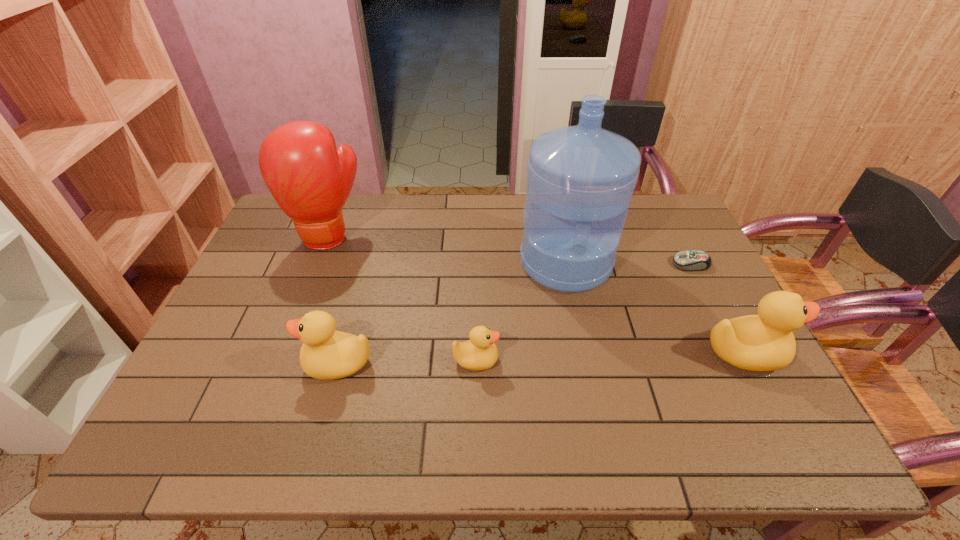
The width and height of the screenshot is (960, 540). What are the coordinates of `vacant space at the near right corner of the desktop` in the screenshot? It's located at (768, 384).

You are a GUI agent. You are given a task and a screenshot of the screen. Output one action in this format:
    pyautogui.click(x=<x>, y=<y>)
    Task: Click on the free spot between the leftmost duck and the shortest object
    
    Given the screenshot: What is the action you would take?
    pyautogui.click(x=515, y=314)

Where is `free space between the second shortest duck and the fifth tallest object`? free space between the second shortest duck and the fifth tallest object is located at coordinates (407, 362).

Locate an element on the screen. This screenshot has height=540, width=960. unoccupied position between the tallest object and the fifth tallest object is located at coordinates (520, 311).

I want to click on free area in between the water jug and the fifth shortest object, so click(x=447, y=249).

Identify the location of vacant area that lies between the rightmost duck and the computer mouse. This screenshot has height=540, width=960. (717, 309).

At what (x,y) coordinates should I click in order to perform the action: click on free area in between the fifth shortest object and the rightmost duck. Please return your answer as a coordinate pair (x, y). This screenshot has height=540, width=960. Looking at the image, I should click on (537, 295).

At what (x,y) coordinates should I click in order to perform the action: click on free space between the third shortest object and the boxing glove. Please return your answer as a coordinate pair (x, y). The height and width of the screenshot is (540, 960). Looking at the image, I should click on (334, 300).

The width and height of the screenshot is (960, 540). In order to click on free spot between the shortest object and the rightmost duck in this screenshot , I will do `click(717, 309)`.

Find the location of `free space between the fourth object from left to right and the fourth tallest object`. free space between the fourth object from left to right and the fourth tallest object is located at coordinates (452, 313).